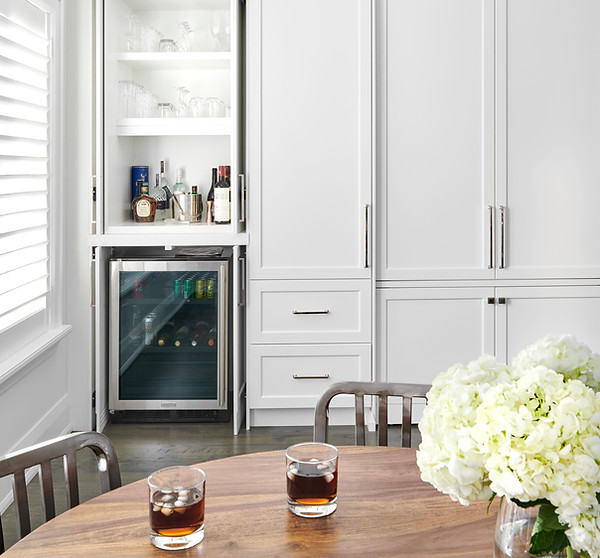
Identify the location of cabinet. (563, 161).